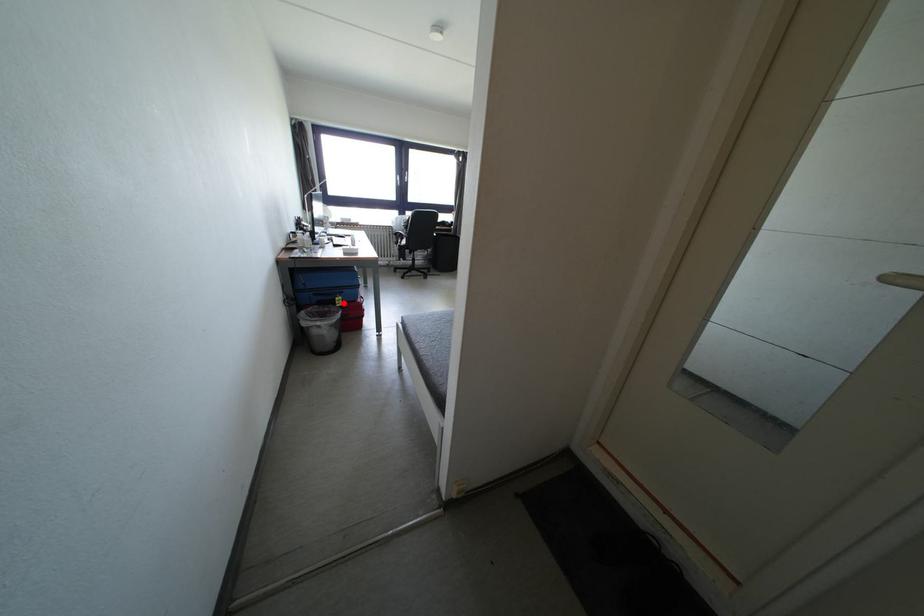
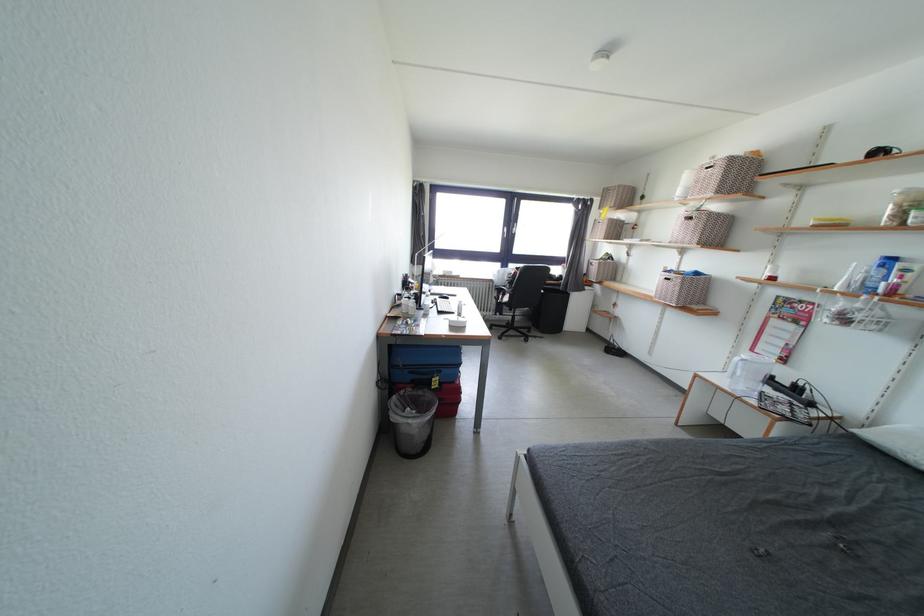
Question: I am providing you with two images of the same scene from different viewpoints. Given a red point in image1, look at the same physical point in image2. Is it:

Choices:
 (A) Closer to the viewpoint
 (B) Farther from the viewpoint

Answer: (B)